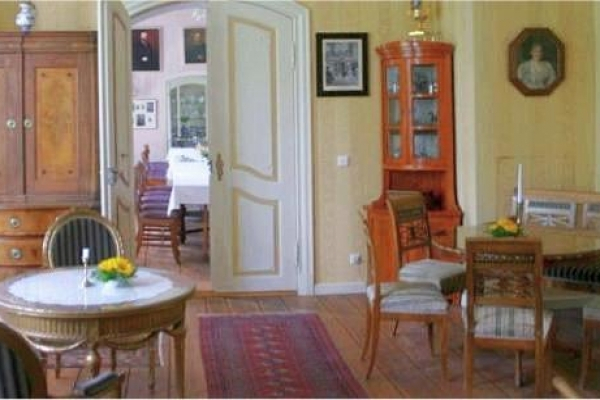
Where is `door handle`? Image resolution: width=600 pixels, height=400 pixels. door handle is located at coordinates (121, 178), (211, 164).